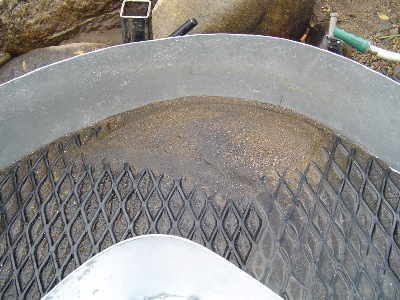
Where is `handle`? handle is located at coordinates (347, 39), (189, 22).